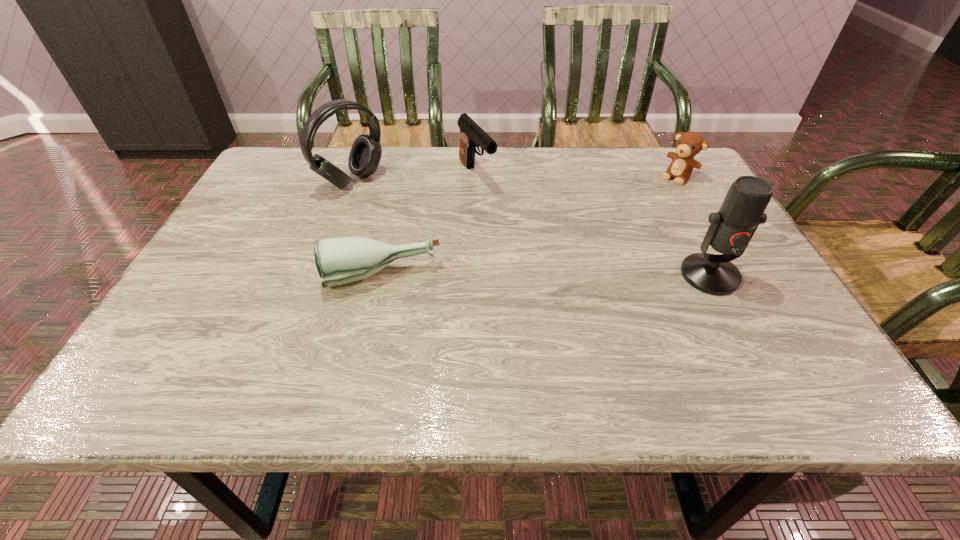
Locate an element on the screen. The width and height of the screenshot is (960, 540). free space located at the barrel of the pistol is located at coordinates (502, 212).

The width and height of the screenshot is (960, 540). I want to click on vacant space located 0.130m on the face of the fourth tallest object, so click(x=645, y=204).

You are a GUI agent. You are given a task and a screenshot of the screen. Output one action in this format:
    pyautogui.click(x=<x>, y=<y>)
    Task: Click on the free space located 0.200m on the face of the fourth tallest object
    Image resolution: width=960 pixels, height=540 pixels.
    Given the screenshot: What is the action you would take?
    pyautogui.click(x=631, y=216)

This screenshot has width=960, height=540. What are the coordinates of `free space located on the face of the fourth tallest object` in the screenshot? It's located at (657, 194).

Locate an element on the screen. Image resolution: width=960 pixels, height=540 pixels. blank space located 0.090m on the earcups of the headset is located at coordinates (393, 207).

You are a GUI agent. You are given a task and a screenshot of the screen. Output one action in this format:
    pyautogui.click(x=<x>, y=<y>)
    Task: Click on the vacant space situated 0.370m on the earcups of the headset
    
    Given the screenshot: What is the action you would take?
    pyautogui.click(x=472, y=259)

Find the location of a particular element. vacant region located 0.230m on the earcups of the headset is located at coordinates (430, 232).

Locate an element on the screen. This screenshot has height=540, width=960. pistol located at the far edge is located at coordinates (472, 135).

Identify the location of teddy bear that is positioned at the far edge. Image resolution: width=960 pixels, height=540 pixels. (689, 144).

Identify the location of headset that is at the far edge. (365, 155).